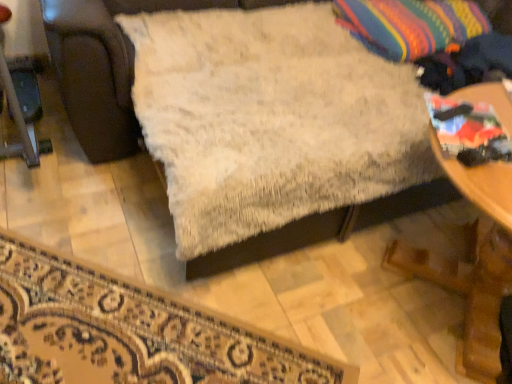
I want to click on free spot to the right of white fluffy rug at lower center, so click(x=347, y=299).